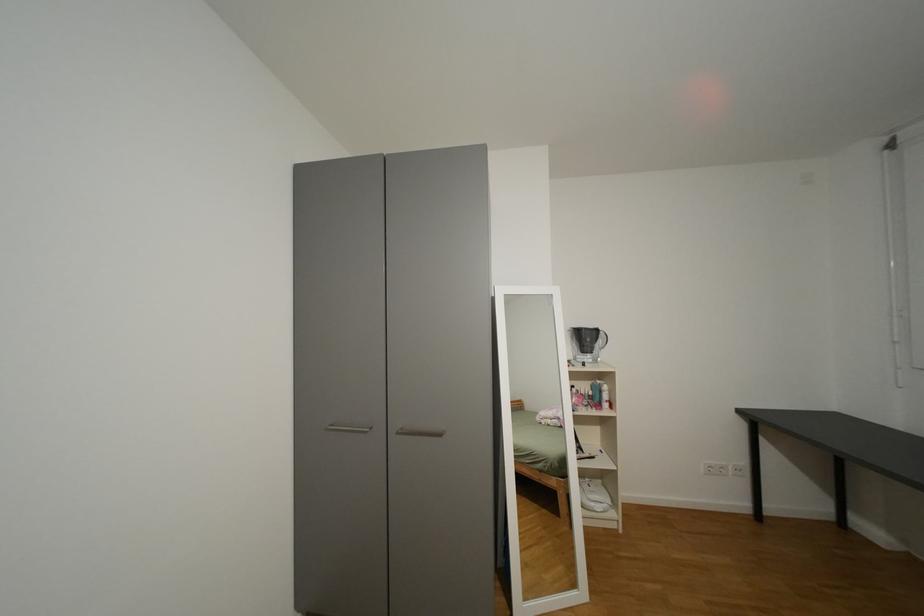
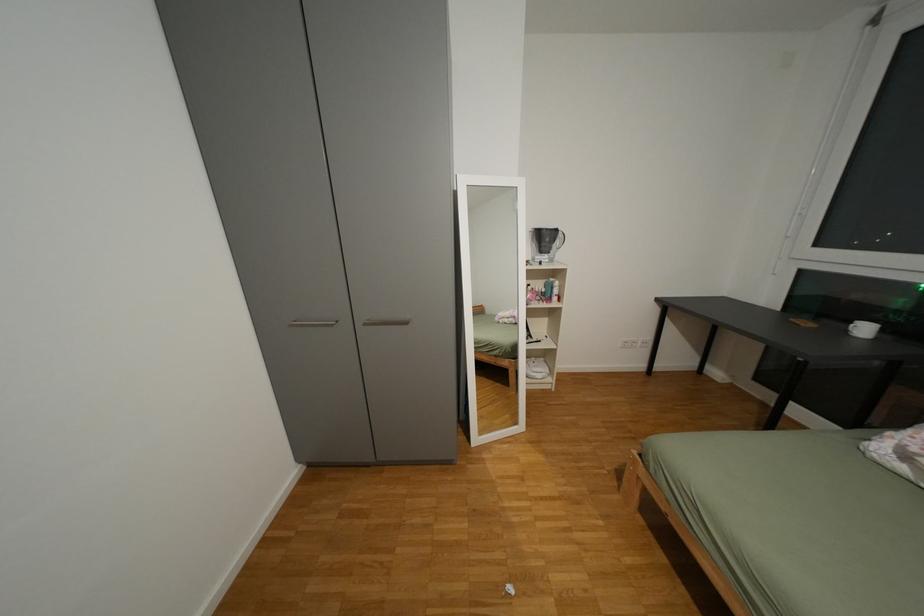
Question: How did the camera likely rotate?

Choices:
 (A) Left
 (B) Right
 (C) Up
 (D) Down

Answer: (D)